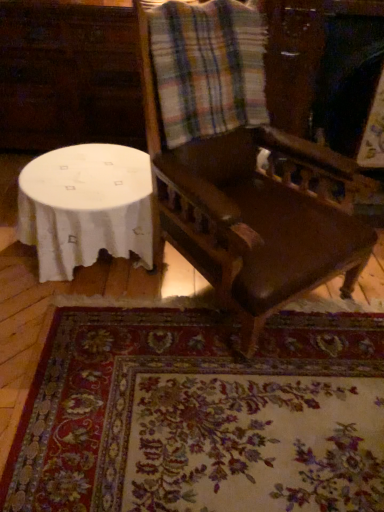
Question: From a real-world perspective, relative to floral carpet at lower center, is plaid fabric at upper center vertically above or below?

Choices:
 (A) above
 (B) below

Answer: (A)

Question: Is plaid fabric at upper center in front of or behind floral carpet at lower center in the image?

Choices:
 (A) front
 (B) behind

Answer: (B)

Question: Which is nearer to the white cloth-covered table at lower left?

Choices:
 (A) plaid fabric at upper center
 (B) dark brown wood chair at center
 (C) floral carpet at lower center

Answer: (B)

Question: Estimate the real-world distances between objects in this image. Which object is farther from the dark brown wood chair at center?

Choices:
 (A) floral carpet at lower center
 (B) plaid fabric at upper center
 (C) white cloth-covered table at lower left

Answer: (A)